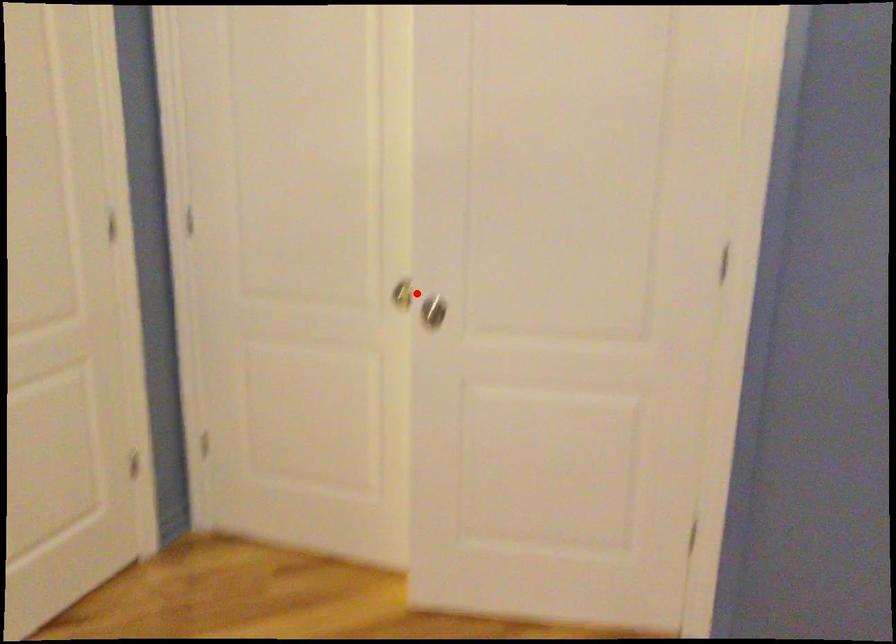
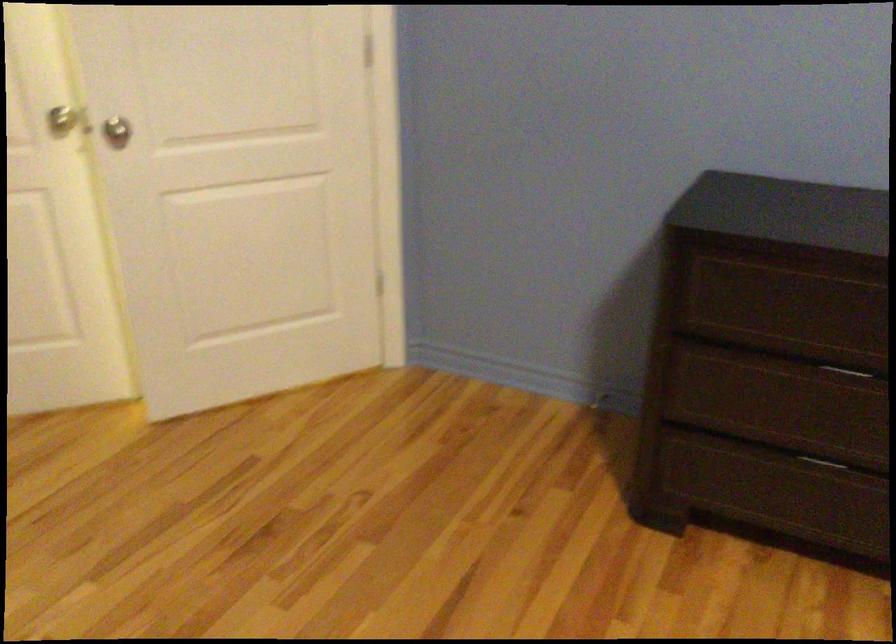
The point at the highlighted location is marked in the first image. Where is the corresponding point in the second image?

(62, 118)